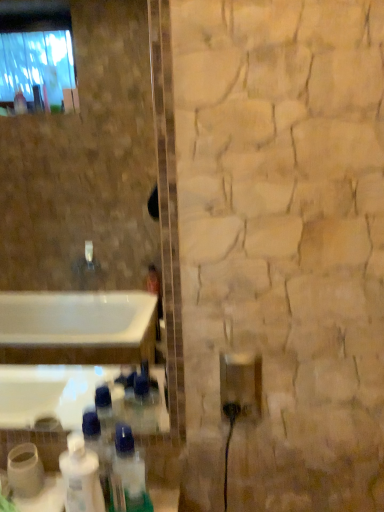
Question: Is the surface of white glossy bottle at lower left in direct contact with clear plastic bottle at lower center, the 2th bottle viewed from the left?

Choices:
 (A) no
 (B) yes

Answer: (B)

Question: From a real-world perspective, is white glossy bottle at lower left positioned over clear plastic bottle at lower center, the 2th bottle viewed from the left, based on gravity?

Choices:
 (A) yes
 (B) no

Answer: (B)

Question: Considering the relative positions of white glossy bottle at lower left and clear plastic bottle at lower center, which ranks as the first bottle in right-to-left order, in the image provided, is white glossy bottle at lower left in front of clear plastic bottle at lower center, which ranks as the first bottle in right-to-left order,?

Choices:
 (A) no
 (B) yes

Answer: (B)

Question: Does white glossy bottle at lower left appear on the left side of clear plastic bottle at lower center, the 2th bottle viewed from the left?

Choices:
 (A) yes
 (B) no

Answer: (A)

Question: Considering the relative sizes of white glossy bottle at lower left and clear plastic bottle at lower center, which ranks as the first bottle in right-to-left order, in the image provided, is white glossy bottle at lower left shorter than clear plastic bottle at lower center, which ranks as the first bottle in right-to-left order,?

Choices:
 (A) yes
 (B) no

Answer: (A)

Question: From a real-world perspective, is white glossy bottle at lower left, which is counted as the 1th bottle, starting from the left, physically located above or below white glossy bottle at lower left?

Choices:
 (A) above
 (B) below

Answer: (A)

Question: In terms of width, does white glossy bottle at lower left, which is counted as the 1th bottle, starting from the left, look wider or thinner when compared to white glossy bottle at lower left?

Choices:
 (A) thin
 (B) wide

Answer: (B)

Question: Does point (104, 499) appear closer or farther from the camera than point (82, 446)?

Choices:
 (A) farther
 (B) closer

Answer: (B)

Question: Would you say white glossy bottle at lower left, which is counted as the 1th bottle, starting from the left, is inside or outside white glossy bottle at lower left?

Choices:
 (A) outside
 (B) inside

Answer: (A)

Question: Is clear plastic bottle at lower center, the 2th bottle viewed from the left, inside or outside of white glossy bottle at lower left, which appears as the second bottle when viewed from the right?

Choices:
 (A) outside
 (B) inside

Answer: (A)

Question: Considering the positions of clear plastic bottle at lower center, the 2th bottle viewed from the left, and white glossy bottle at lower left, which is counted as the 1th bottle, starting from the left, in the image, is clear plastic bottle at lower center, the 2th bottle viewed from the left, taller or shorter than white glossy bottle at lower left, which is counted as the 1th bottle, starting from the left,?

Choices:
 (A) tall
 (B) short

Answer: (B)

Question: In the image, is clear plastic bottle at lower center, the 2th bottle viewed from the left, positioned in front of or behind white glossy bottle at lower left, which is counted as the 1th bottle, starting from the left?

Choices:
 (A) behind
 (B) front

Answer: (B)

Question: From the image's perspective, is clear plastic bottle at lower center, the 2th bottle viewed from the left, positioned above or below white glossy bottle at lower left, which appears as the second bottle when viewed from the right?

Choices:
 (A) below
 (B) above

Answer: (A)

Question: Considering the positions of white glossy bottle at lower left and clear plastic bottle at lower center, which ranks as the first bottle in right-to-left order, in the image, is white glossy bottle at lower left bigger or smaller than clear plastic bottle at lower center, which ranks as the first bottle in right-to-left order,?

Choices:
 (A) big
 (B) small

Answer: (B)

Question: Considering the positions of point (62, 477) and point (140, 473), is point (62, 477) closer or farther from the camera than point (140, 473)?

Choices:
 (A) farther
 (B) closer

Answer: (B)